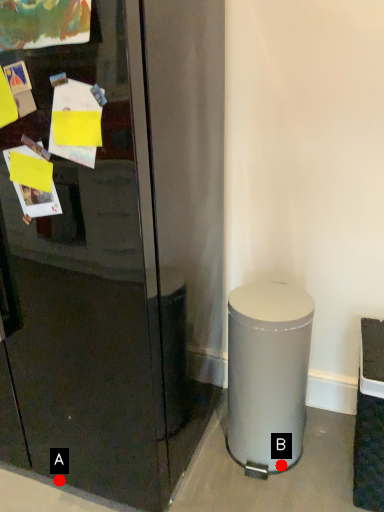
Question: Two points are circled on the image, labeled by A and B beside each circle. Among these points, which one is nearest to the camera?

Choices:
 (A) A is closer
 (B) B is closer

Answer: (A)